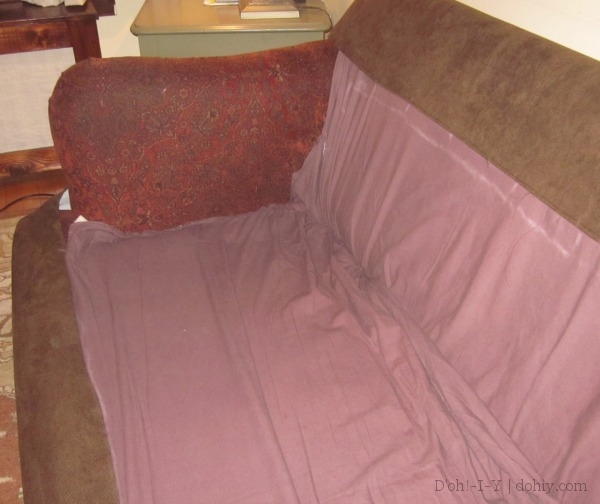
Locate an element on the screen. light brown top to end table is located at coordinates (180, 21).